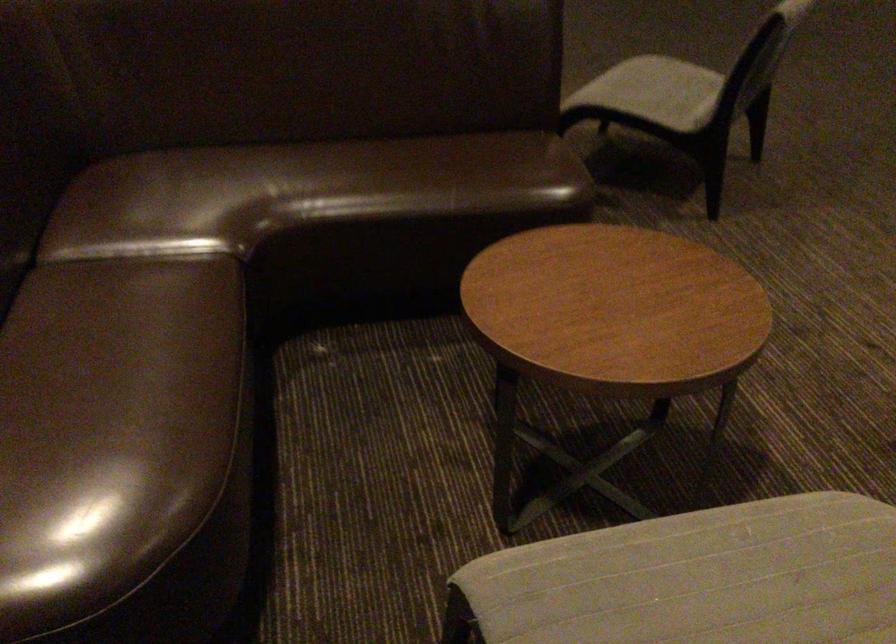
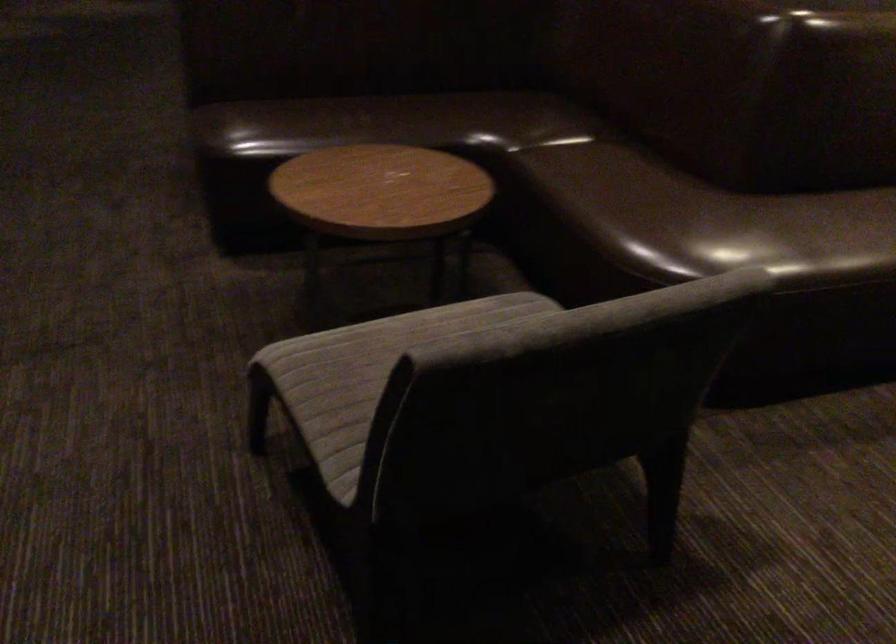
The images are taken continuously from a first-person perspective. In which direction are you moving?

The movement direction of the cameraman is left, backward.